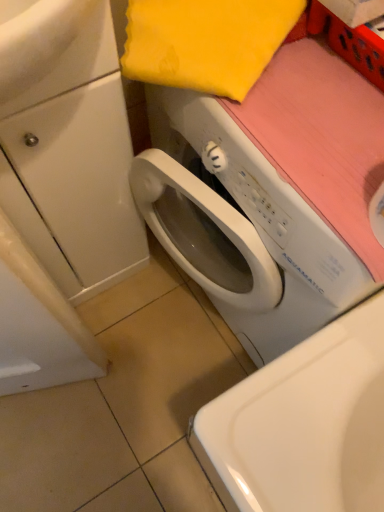
Question: From the image's perspective, does white glossy cabinet at left appear lower than white plastic washing machine at center?

Choices:
 (A) yes
 (B) no

Answer: (B)

Question: Is white glossy cabinet at left positioned behind white plastic washing machine at center?

Choices:
 (A) no
 (B) yes

Answer: (B)

Question: Is white glossy cabinet at left at the right side of white plastic washing machine at center?

Choices:
 (A) yes
 (B) no

Answer: (B)

Question: Would you say white glossy cabinet at left contains white plastic washing machine at center?

Choices:
 (A) no
 (B) yes

Answer: (A)

Question: Is white glossy cabinet at left positioned before white plastic washing machine at center?

Choices:
 (A) yes
 (B) no

Answer: (B)

Question: Considering their positions, is white glossy sink at upper left located in front of or behind white glossy cabinet at left?

Choices:
 (A) front
 (B) behind

Answer: (A)

Question: Considering the relative positions of white glossy sink at upper left and white glossy cabinet at left in the image provided, is white glossy sink at upper left to the left or to the right of white glossy cabinet at left?

Choices:
 (A) left
 (B) right

Answer: (B)

Question: In terms of size, does white glossy sink at upper left appear bigger or smaller than white glossy cabinet at left?

Choices:
 (A) big
 (B) small

Answer: (B)

Question: Is white glossy sink at upper left situated inside white glossy cabinet at left or outside?

Choices:
 (A) inside
 (B) outside

Answer: (A)

Question: In terms of height, does white plastic washing machine at center look taller or shorter compared to white glossy sink at upper left?

Choices:
 (A) tall
 (B) short

Answer: (A)

Question: Considering their positions, is white plastic washing machine at center located in front of or behind white glossy sink at upper left?

Choices:
 (A) front
 (B) behind

Answer: (B)

Question: From a real-world perspective, is white plastic washing machine at center above or below white glossy sink at upper left?

Choices:
 (A) below
 (B) above

Answer: (A)

Question: In the image, is white plastic washing machine at center on the left side or the right side of white glossy sink at upper left?

Choices:
 (A) left
 (B) right

Answer: (B)

Question: Would you say white plastic washing machine at center is to the left or to the right of white glossy cabinet at left in the picture?

Choices:
 (A) left
 (B) right

Answer: (B)

Question: Considering their positions, is white plastic washing machine at center located in front of or behind white glossy cabinet at left?

Choices:
 (A) behind
 (B) front

Answer: (B)